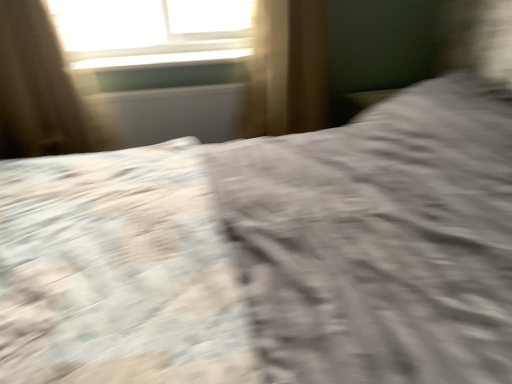
Question: Is white glossy window sill at upper center surrounded by textured gray sheet at center?

Choices:
 (A) no
 (B) yes

Answer: (A)

Question: Is textured gray sheet at center aimed at white glossy window sill at upper center?

Choices:
 (A) yes
 (B) no

Answer: (B)

Question: Can you confirm if textured gray sheet at center is wider than white glossy window sill at upper center?

Choices:
 (A) yes
 (B) no

Answer: (A)

Question: Is textured gray sheet at center oriented away from white glossy window sill at upper center?

Choices:
 (A) no
 (B) yes

Answer: (A)

Question: Is textured gray sheet at center thinner than white glossy window sill at upper center?

Choices:
 (A) no
 (B) yes

Answer: (A)

Question: From the image's perspective, is white glossy window sill at upper center above or below textured gray sheet at center?

Choices:
 (A) below
 (B) above

Answer: (B)

Question: Is white glossy window sill at upper center to the left or to the right of textured gray sheet at center in the image?

Choices:
 (A) right
 (B) left

Answer: (A)

Question: Is point (102, 51) closer or farther from the camera than point (44, 251)?

Choices:
 (A) closer
 (B) farther

Answer: (B)

Question: Is white glossy window sill at upper center taller or shorter than textured gray sheet at center?

Choices:
 (A) tall
 (B) short

Answer: (B)

Question: From a real-world perspective, is white glossy window sill at upper center above or below brown fabric curtain at upper left?

Choices:
 (A) above
 (B) below

Answer: (A)

Question: In the image, is white glossy window sill at upper center on the left side or the right side of brown fabric curtain at upper left?

Choices:
 (A) right
 (B) left

Answer: (A)

Question: In the image, is white glossy window sill at upper center positioned in front of or behind brown fabric curtain at upper left?

Choices:
 (A) behind
 (B) front

Answer: (A)

Question: Looking at their shapes, would you say white glossy window sill at upper center is wider or thinner than brown fabric curtain at upper left?

Choices:
 (A) wide
 (B) thin

Answer: (A)

Question: Is brown fabric curtain at upper left inside or outside of textured gray sheet at center?

Choices:
 (A) inside
 (B) outside

Answer: (B)

Question: Visually, is brown fabric curtain at upper left positioned to the left or to the right of textured gray sheet at center?

Choices:
 (A) left
 (B) right

Answer: (A)